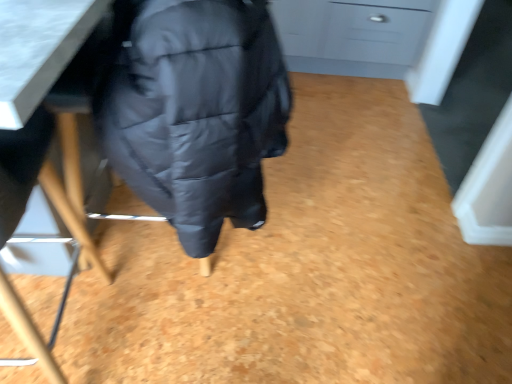
Question: Would you say matte black chair at lower left is to the left or to the right of matte black jacket at under table in the picture?

Choices:
 (A) left
 (B) right

Answer: (A)

Question: Does point (4, 279) appear closer or farther from the camera than point (203, 226)?

Choices:
 (A) closer
 (B) farther

Answer: (A)

Question: Which is farther from the matte gray drawer at upper right?

Choices:
 (A) matte black chair at lower left
 (B) matte black jacket at under table

Answer: (A)

Question: Based on their relative distances, which object is farther from the matte black chair at lower left?

Choices:
 (A) matte gray drawer at upper right
 (B) matte black jacket at under table

Answer: (A)